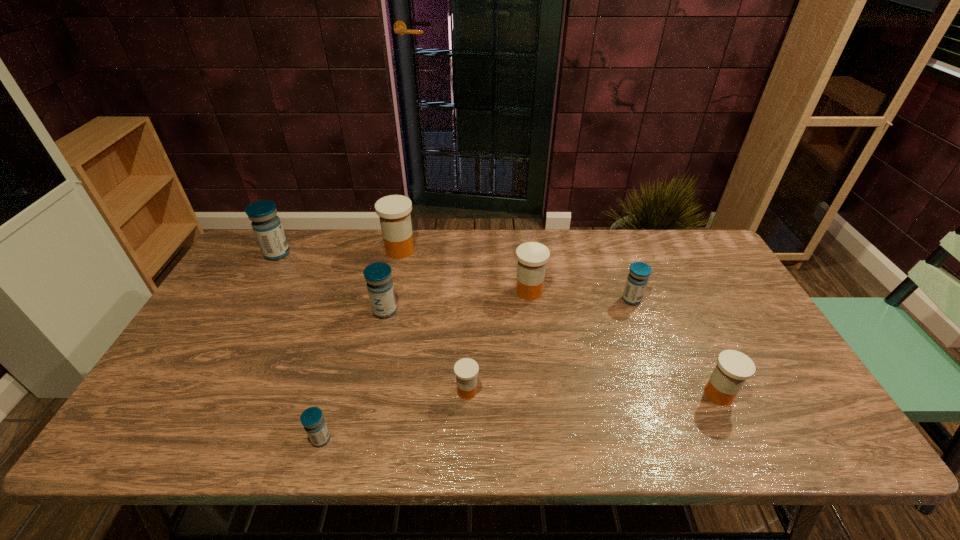
Identify the location of the rightmost object. (733, 368).

You are a GUI agent. You are given a task and a screenshot of the screen. Output one action in this format:
    pyautogui.click(x=<x>, y=<y>)
    Task: Click on the third orange medicine from right to left
    Image resolution: width=960 pixels, height=540 pixels.
    Given the screenshot: What is the action you would take?
    pyautogui.click(x=466, y=369)

At what (x,y) coordinates should I click in order to perform the action: click on the smallest orange medicine. Please return your answer as a coordinate pair (x, y). The width and height of the screenshot is (960, 540). Looking at the image, I should click on (466, 369).

This screenshot has width=960, height=540. Identify the location of the nearest blue medicine. (312, 419).

I want to click on the smallest blue medicine, so click(312, 419).

Find the location of a particular element. This screenshot has height=540, width=960. free space located on the right of the leftmost object is located at coordinates (326, 254).

This screenshot has height=540, width=960. I want to click on vacant region located on the label of the farthest orange medicine, so click(524, 250).

Image resolution: width=960 pixels, height=540 pixels. Find the location of `vacant space located 0.260m on the label of the sixth object from left to right`. vacant space located 0.260m on the label of the sixth object from left to right is located at coordinates (427, 291).

Where is `vacant area situated on the label of the sixth object from left to right`? vacant area situated on the label of the sixth object from left to right is located at coordinates (464, 291).

At what (x,y) coordinates should I click in order to perform the action: click on free region located on the label of the sixth object from left to right. Please return your answer as a coordinate pair (x, y). Looking at the image, I should click on (491, 291).